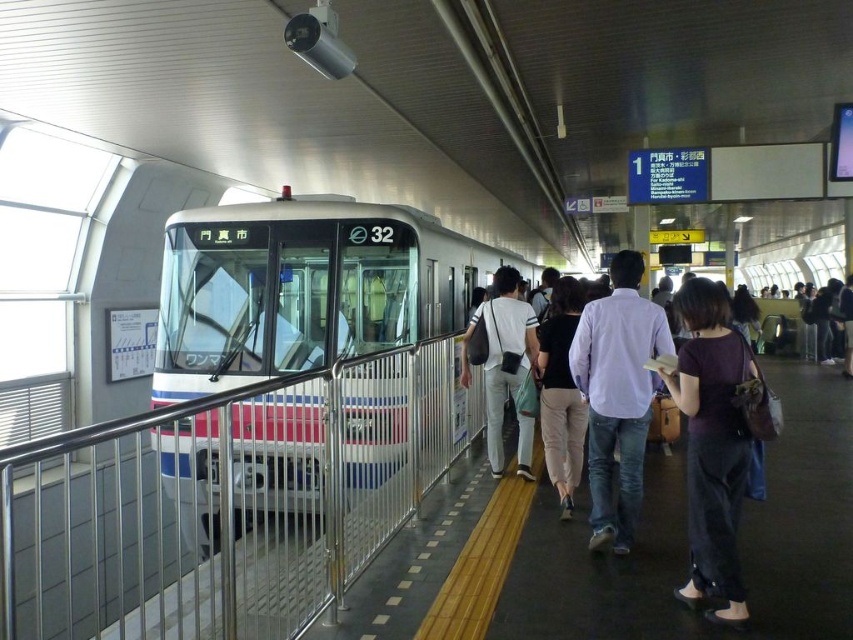
Question: Among these points, which one is farthest from the camera?

Choices:
 (A) (608, 528)
 (B) (170, 492)
 (C) (514, 362)
 (D) (350, 288)

Answer: (B)

Question: Can you confirm if white glossy train at center is positioned to the right of dark purple fabric shirt at center-right?

Choices:
 (A) no
 (B) yes

Answer: (A)

Question: Observing the image, what is the correct spatial positioning of silver metallic rail at left in reference to white fabric bag at center?

Choices:
 (A) below
 (B) above

Answer: (A)

Question: Which object is farther from the camera taking this photo?

Choices:
 (A) white fabric bag at center
 (B) silver metallic rail at left

Answer: (B)

Question: Which object is positioned closest to the purple cotton shirt at center?

Choices:
 (A) silver metallic rail at left
 (B) white glossy train at center

Answer: (B)

Question: Is purple cotton shirt at center to the right of white fabric bag at center from the viewer's perspective?

Choices:
 (A) yes
 (B) no

Answer: (A)